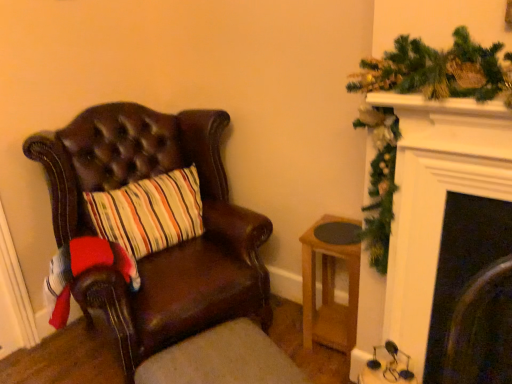
Question: From their relative heights in the image, would you say brown leather footrest at lower left is taller or shorter than leather chair at left?

Choices:
 (A) tall
 (B) short

Answer: (B)

Question: From a real-world perspective, is brown leather footrest at lower left above or below leather chair at left?

Choices:
 (A) below
 (B) above

Answer: (A)

Question: Which object is positioned closest to the light brown wooden stool at lower right?

Choices:
 (A) brown leather footrest at lower left
 (B) leather chair at left

Answer: (A)

Question: Considering the real-world distances, which object is farthest from the brown leather footrest at lower left?

Choices:
 (A) light brown wooden stool at lower right
 (B) leather chair at left

Answer: (A)